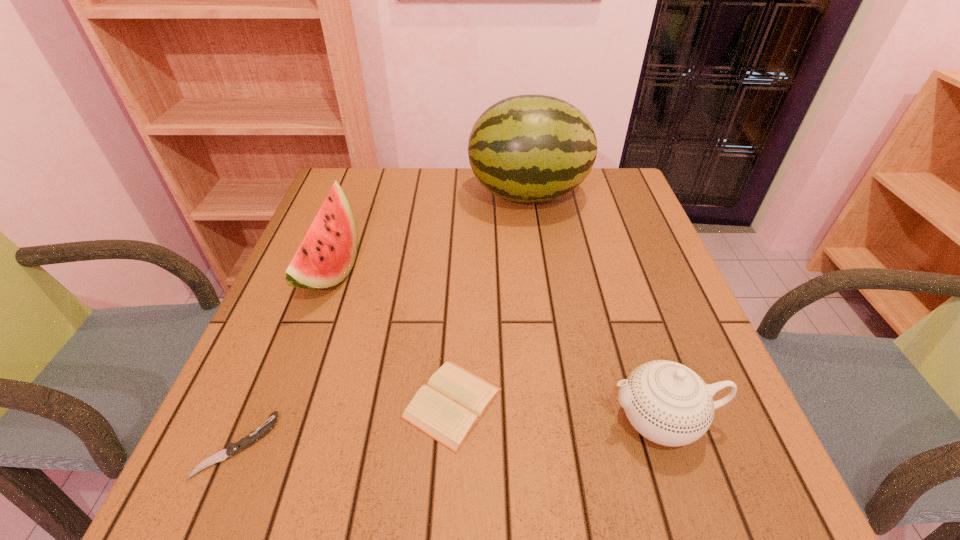
The image size is (960, 540). Find the location of `vacant space located 0.160m on the outer rind of the left watermelon`. vacant space located 0.160m on the outer rind of the left watermelon is located at coordinates [423, 271].

Image resolution: width=960 pixels, height=540 pixels. Find the location of `vacant space located 0.390m on the spout of the chinaware`. vacant space located 0.390m on the spout of the chinaware is located at coordinates (376, 418).

Locate an element on the screen. blank space located on the spout of the chinaware is located at coordinates (558, 418).

This screenshot has height=540, width=960. Identify the location of vacant space located on the spout of the chinaware. (499, 418).

This screenshot has height=540, width=960. What are the coordinates of `free space located on the right of the fourth tallest object` in the screenshot? It's located at (656, 403).

I want to click on vacant space located 0.110m on the back of the pocketknife, so click(272, 361).

The height and width of the screenshot is (540, 960). In order to click on object at the far edge in this screenshot , I will do `click(528, 148)`.

This screenshot has height=540, width=960. Identify the location of chinaware at the near edge. (668, 403).

At what (x,y) coordinates should I click in order to perform the action: click on pocketknife that is at the near edge. Please return your answer as a coordinate pair (x, y). The image size is (960, 540). Looking at the image, I should click on (232, 449).

At what (x,y) coordinates should I click in order to perform the action: click on watermelon that is at the left edge. Please return your answer as a coordinate pair (x, y). The height and width of the screenshot is (540, 960). Looking at the image, I should click on (325, 257).